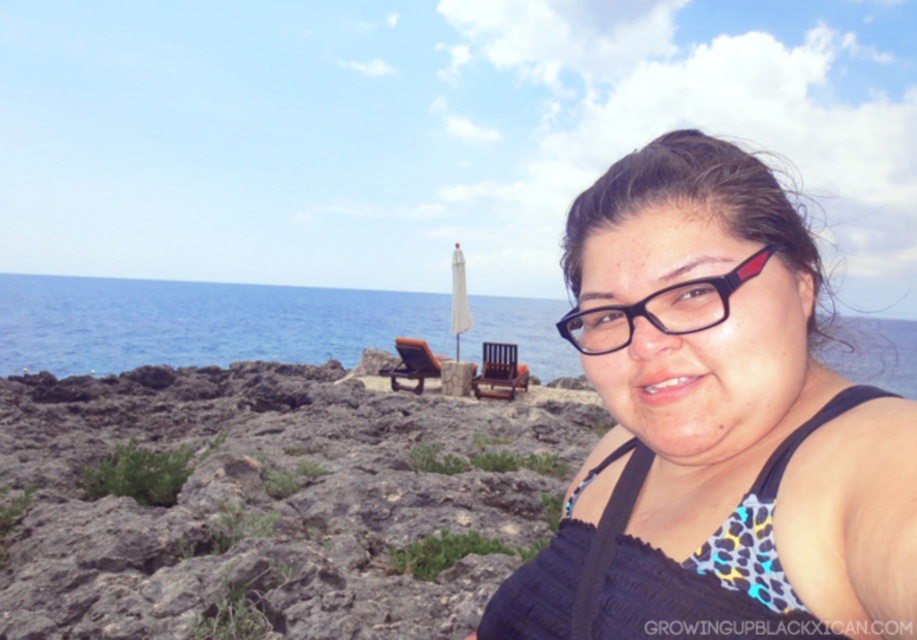
Is black matte swimsuit at center wider than blue water at center?

No, black matte swimsuit at center is not wider than blue water at center.

Can you confirm if black matte swimsuit at center is positioned to the right of blue water at center?

Yes, black matte swimsuit at center is to the right of blue water at center.

Does point (685, 488) come farther from viewer compared to point (226, 300)?

That is False.

Where is `black matte swimsuit at center`? The height and width of the screenshot is (640, 917). black matte swimsuit at center is located at coordinates (715, 428).

Between blue water at center and black plastic glasses at center, which one has more height?

blue water at center

Which is more to the right, blue water at center or black plastic glasses at center?

From the viewer's perspective, black plastic glasses at center appears more on the right side.

Find the location of a particular element. This screenshot has height=640, width=917. blue water at center is located at coordinates (200, 323).

Can you confirm if black matte swimsuit at center is bigger than black plastic glasses at center?

Correct, black matte swimsuit at center is larger in size than black plastic glasses at center.

Can you confirm if black matte swimsuit at center is thinner than black plastic glasses at center?

No.

Which is behind, point (630, 442) or point (573, 323)?

The point (630, 442) is behind.

Where is `black matte swimsuit at center`? black matte swimsuit at center is located at coordinates (715, 428).